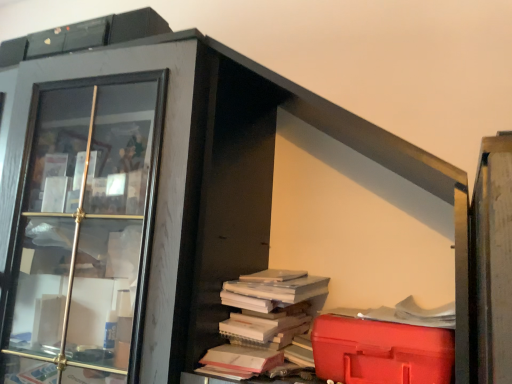
What are the coordinates of `free space above red plastic toolbox at lower right (from a real-world perspective)` in the screenshot? It's located at (401, 315).